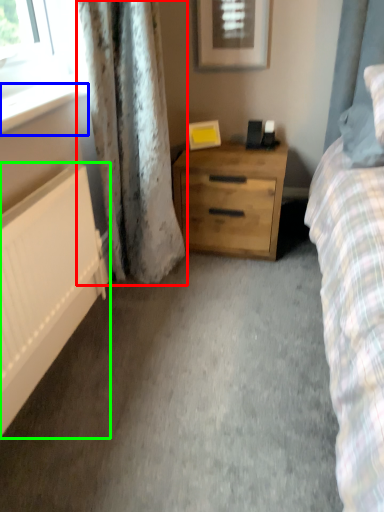
Question: Which object is positioned closest to curtain (highlighted by a red box)? Select from window sill (highlighted by a blue box) and radiator (highlighted by a green box).

Choices:
 (A) window sill
 (B) radiator

Answer: (A)